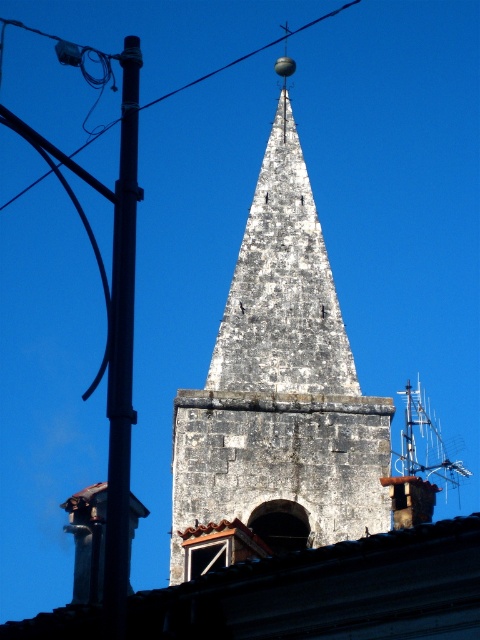
Question: Is metallic pole at left further to the viewer compared to black wire at upper left?

Choices:
 (A) no
 (B) yes

Answer: (A)

Question: Is weathered stone steeple at center above metallic pole at left?

Choices:
 (A) no
 (B) yes

Answer: (A)

Question: Which of the following is the closest to the observer?

Choices:
 (A) (123, 451)
 (B) (192, 83)
 (C) (182, 445)

Answer: (A)

Question: Which is farther from the black wire at upper left?

Choices:
 (A) metallic pole at left
 (B) weathered stone steeple at center

Answer: (B)

Question: Which of the following is the farthest from the observer?

Choices:
 (A) weathered stone steeple at center
 (B) metallic pole at left

Answer: (A)

Question: Is weathered stone steeple at center wider than metallic pole at left?

Choices:
 (A) no
 (B) yes

Answer: (A)